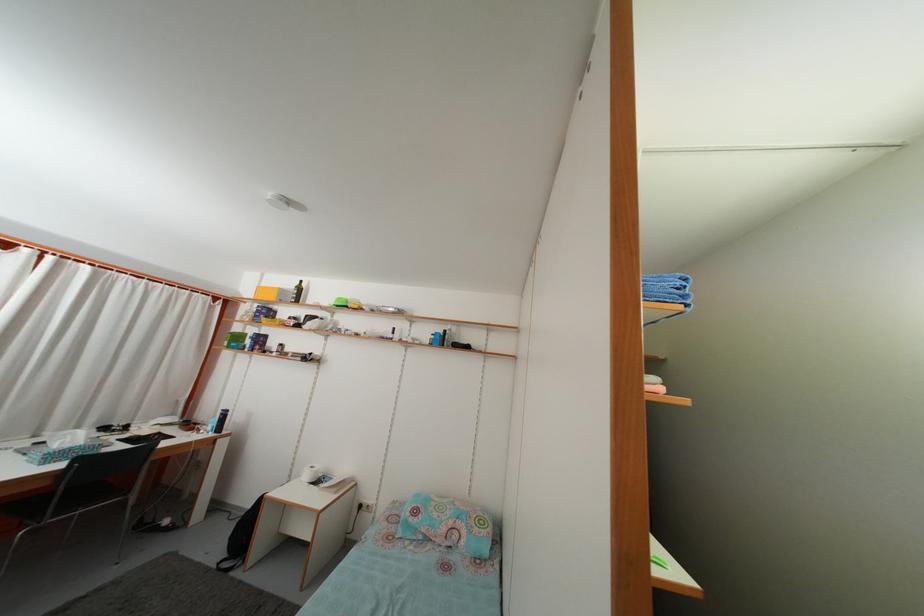
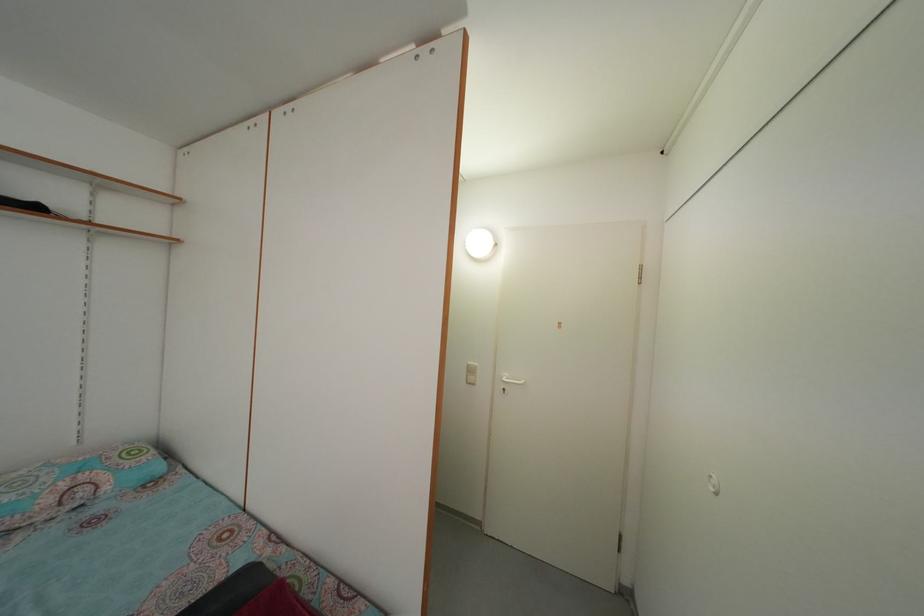
Question: The images are taken continuously from a first-person perspective. In which direction is your viewpoint rotating?

Choices:
 (A) Left
 (B) Right
 (C) Up
 (D) Down

Answer: (B)